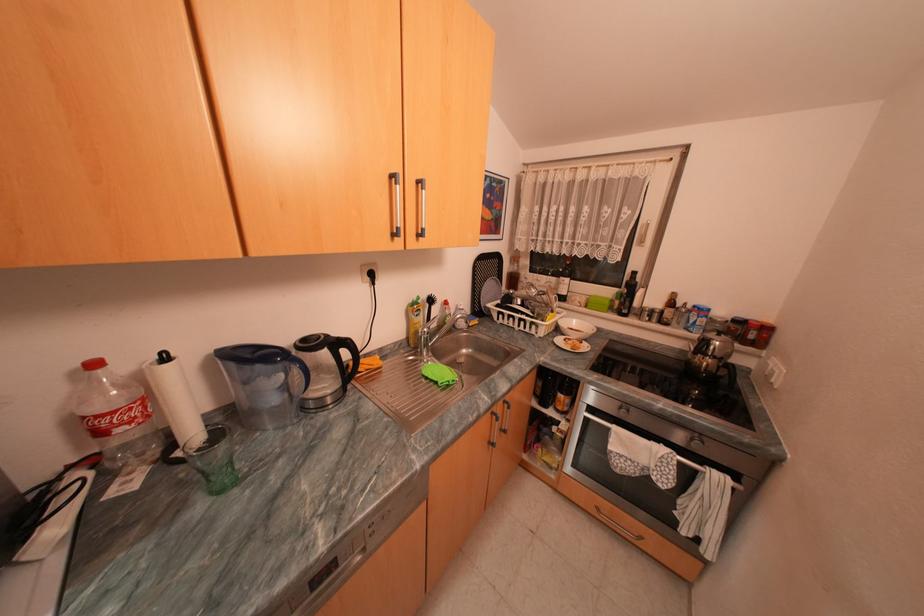
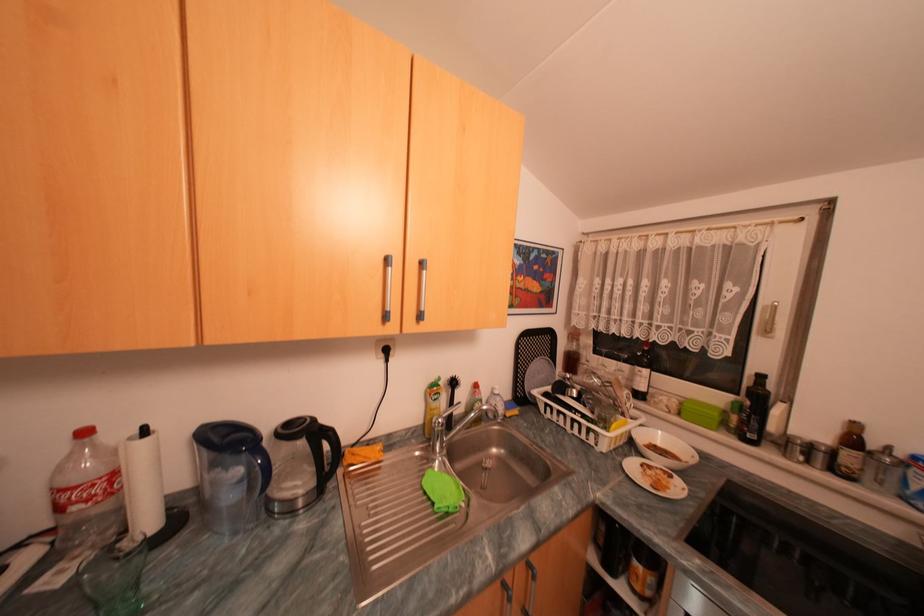
Question: The first image is from the beginning of the video and the second image is from the end. How did the camera likely rotate when shooting the video?

Choices:
 (A) Left
 (B) Right
 (C) Up
 (D) Down

Answer: (A)